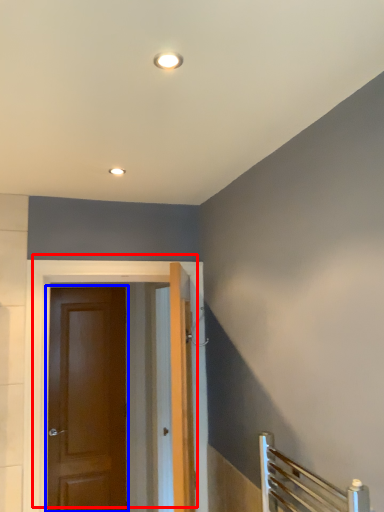
Question: Among these objects, which one is nearest to the camera, door (highlighted by a red box) or door (highlighted by a blue box)?

Choices:
 (A) door
 (B) door

Answer: (A)